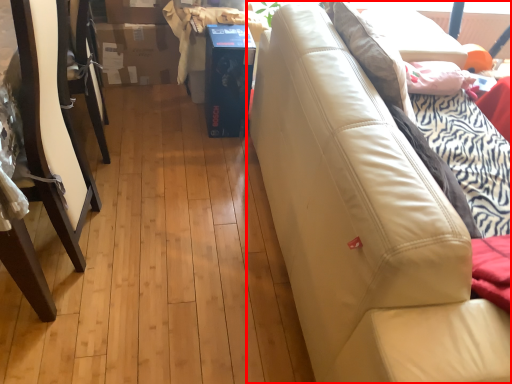
Question: In this image, where is studio couch (annotated by the red box) located relative to furniture?

Choices:
 (A) left
 (B) right

Answer: (B)